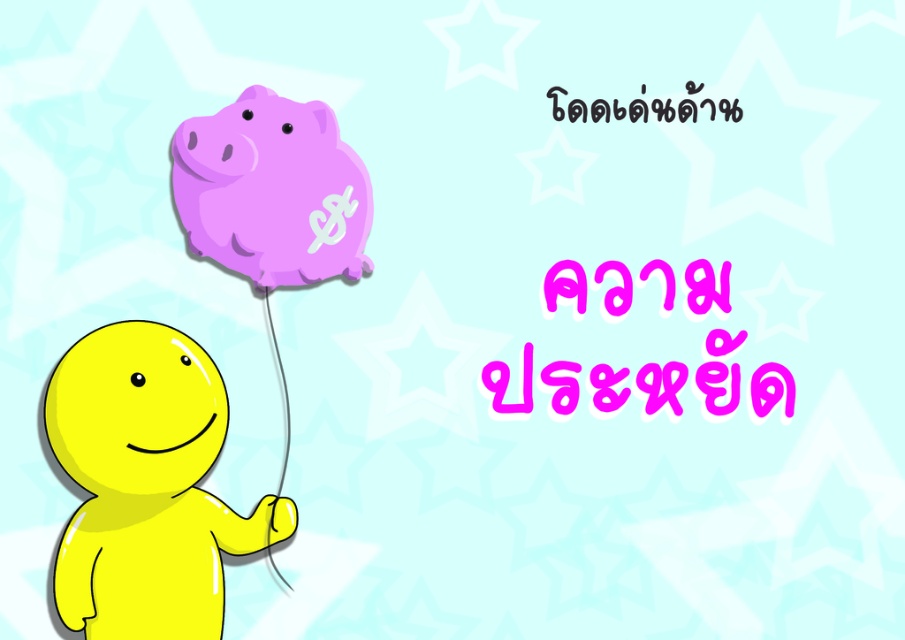
Question: Estimate the real-world distances between objects in this image. Which object is closer to the pink matte text at upper center?

Choices:
 (A) matte purple piggy bank at upper center
 (B) black text at upper center

Answer: (B)

Question: Can you confirm if matte purple piggy bank at upper center is wider than pink matte text at upper center?

Choices:
 (A) no
 (B) yes

Answer: (A)

Question: Among these objects, which one is farthest from the camera?

Choices:
 (A) matte purple piggy bank at upper center
 (B) pink matte text at upper center
 (C) black text at upper center

Answer: (B)

Question: Which object is positioned closest to the pink matte text at upper center?

Choices:
 (A) black text at upper center
 (B) matte purple piggy bank at upper center

Answer: (A)

Question: Is pink matte text at upper center positioned at the back of black text at upper center?

Choices:
 (A) yes
 (B) no

Answer: (A)

Question: Does matte purple piggy bank at upper center have a smaller size compared to black text at upper center?

Choices:
 (A) yes
 (B) no

Answer: (B)